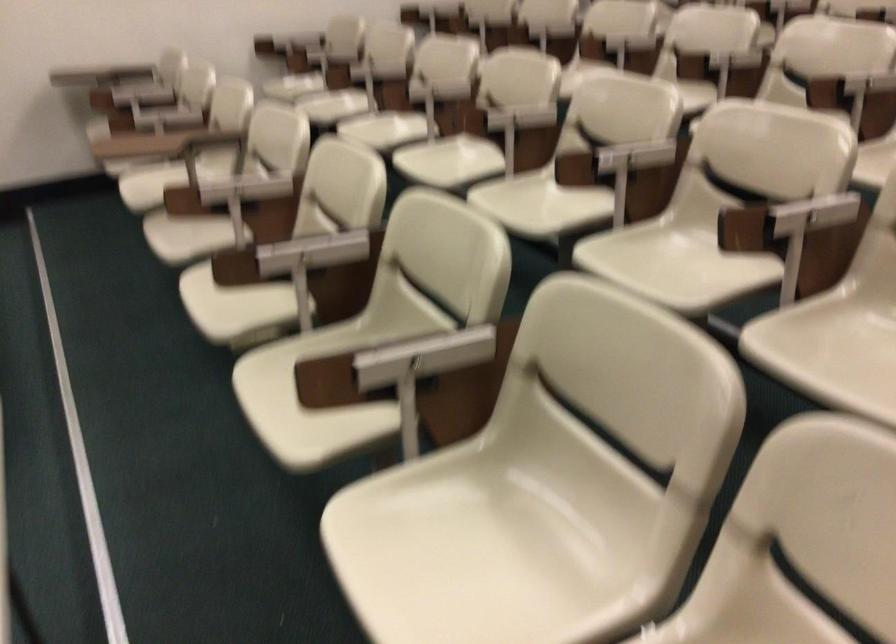
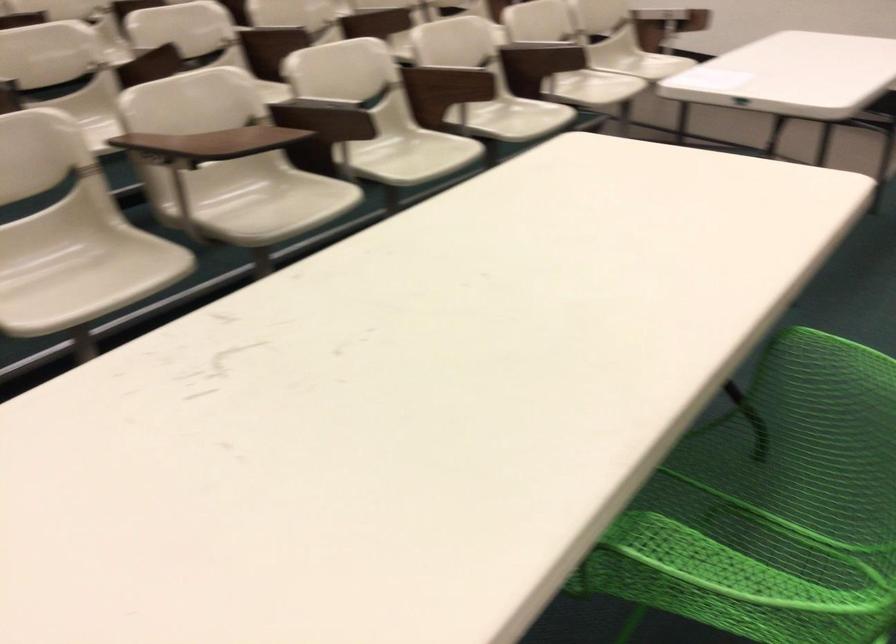
Question: I am providing you with two images of the same scene from different viewpoints. Which of the following objects are not visible in image2?

Choices:
 (A) purple plastic object
 (B) green chair sitting surface
 (C) green chair armrest
 (D) white chair sitting surface

Answer: (D)